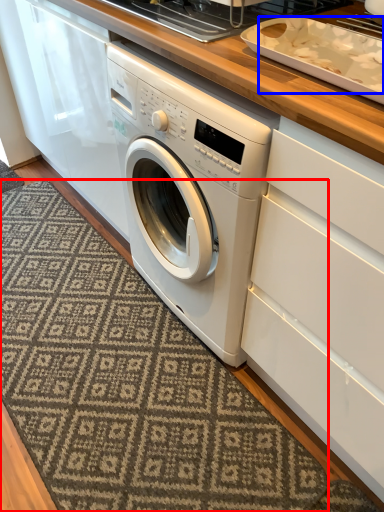
Question: Which point is further to the camera, doormat (highlighted by a red box) or food (highlighted by a blue box)?

Choices:
 (A) doormat
 (B) food

Answer: (A)